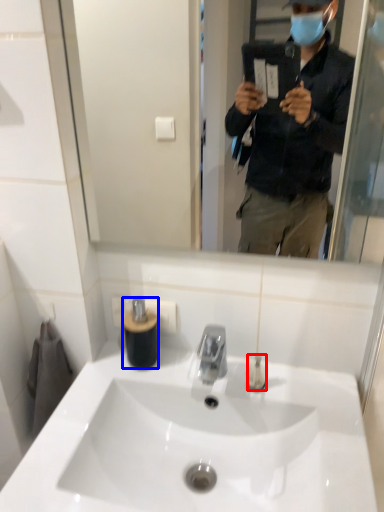
Question: Which point is further to the camera, toiletry (highlighted by a red box) or toiletry (highlighted by a blue box)?

Choices:
 (A) toiletry
 (B) toiletry

Answer: (B)